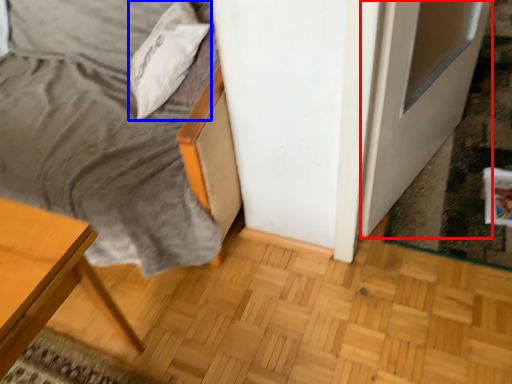
Question: Which object appears closest to the camera in this image, screen door (highlighted by a red box) or pillow (highlighted by a blue box)?

Choices:
 (A) screen door
 (B) pillow

Answer: (A)